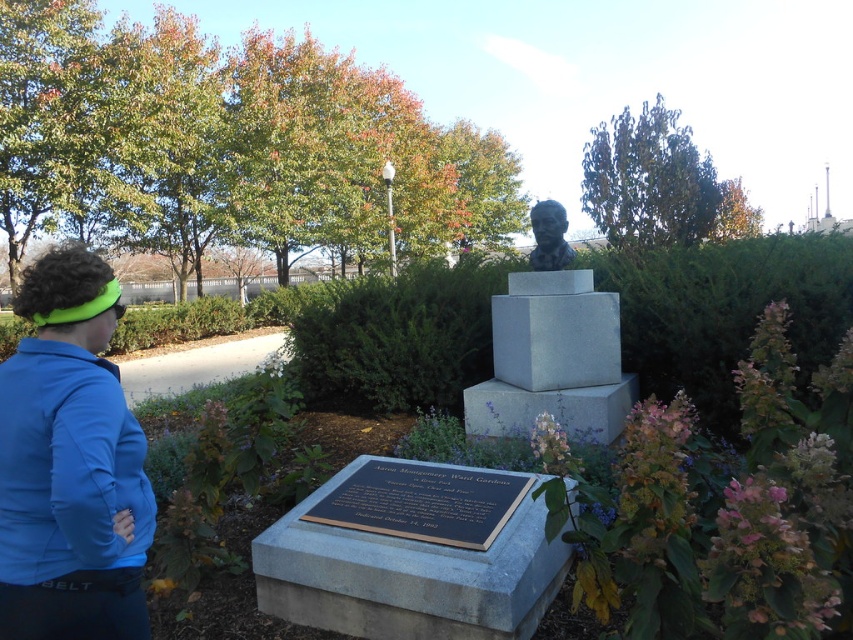
Between blue fabric jacket at lower left and slate gray bust at center, which one is positioned higher?

slate gray bust at center

What do you see at coordinates (70, 465) in the screenshot?
I see `blue fabric jacket at lower left` at bounding box center [70, 465].

Is point (51, 308) positioned after point (575, 404)?

No, (51, 308) is in front of (575, 404).

Where is `blue fabric jacket at lower left`? Image resolution: width=853 pixels, height=640 pixels. blue fabric jacket at lower left is located at coordinates (70, 465).

Between gray stone bust at center and bronze bust at center, which one appears on the right side from the viewer's perspective?

bronze bust at center is more to the right.

Between point (817, 259) and point (564, 227), which one is positioned in front?

Point (564, 227) is in front.

Is point (683, 321) farther from viewer compared to point (555, 248)?

No.

The image size is (853, 640). I want to click on gray stone bust at center, so click(x=407, y=332).

Is blue fabric jacket at lower left below bronze bust at center?

Yes.

Is blue fabric jacket at lower left to the right of bronze bust at center from the viewer's perspective?

No, blue fabric jacket at lower left is not to the right of bronze bust at center.

Does point (33, 595) lie behind point (547, 198)?

No, it is not.

Where is `blue fabric jacket at lower left`? The height and width of the screenshot is (640, 853). blue fabric jacket at lower left is located at coordinates (70, 465).